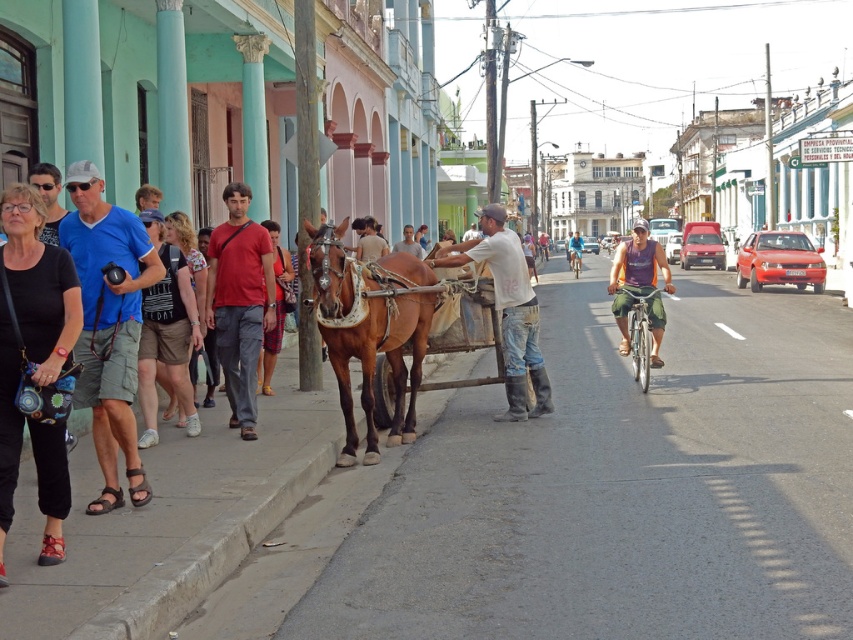
You are a photographer standing on the street and see two people wearing the white cotton shirt at center and the purple fabric shirt at center. Which shirt is shorter in length?

The white cotton shirt at center is shorter than the purple fabric shirt at center.